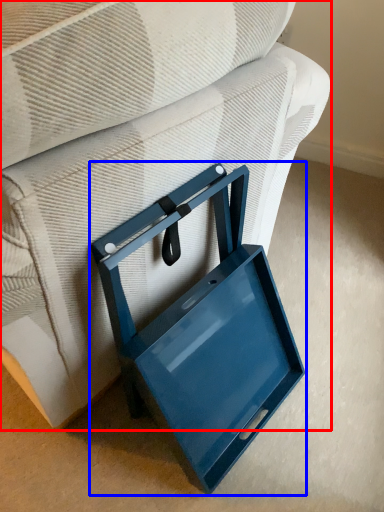
Question: Which of the following is the farthest to the observer, furniture (highlighted by a red box) or lunch box (highlighted by a blue box)?

Choices:
 (A) furniture
 (B) lunch box

Answer: (B)